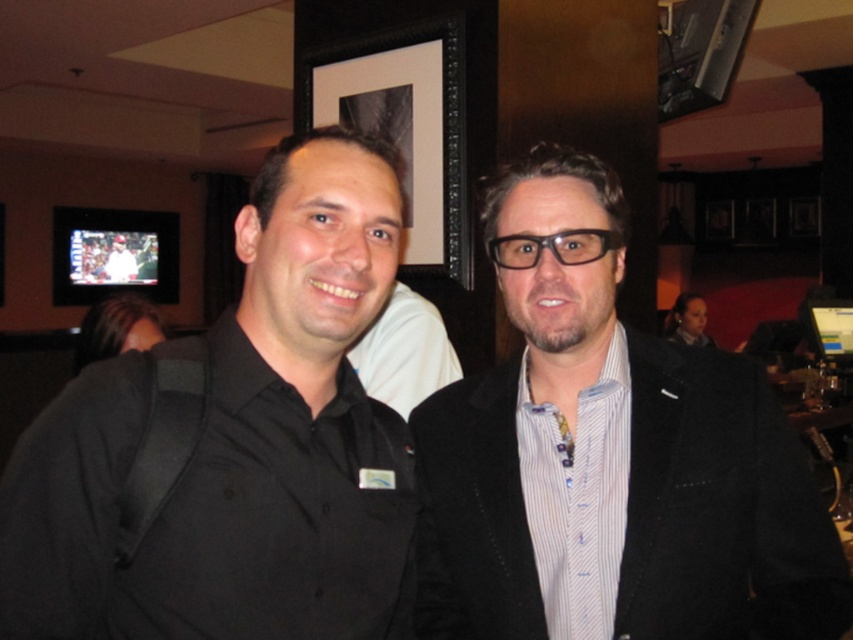
You are a photographer at an event and need to ensure both the matte black suit at center and the black matte shirt at left are visible in your photo. Based on their positions, which one is closer to the front?

The matte black suit at center is closer to the front because the black matte shirt at left is behind it.

You are at a social event and want to locate the matte black suit at center. According to the coordinates given, where would you look in the image?

The matte black suit at center is located at point coordinates (608,458) in the image.

You are standing in the room where the two people are. You want to place a small plant exactly at the point marked as point (x=608, y=458). What object will the plant be placed on?

The plant will be placed on the matte black suit at center located at point (x=608, y=458).